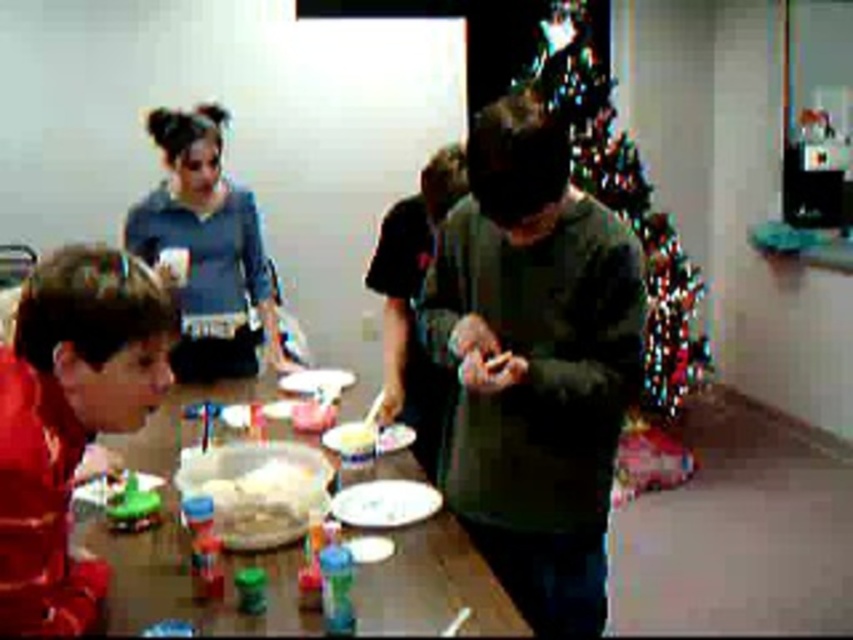
You are organizing a craft event and need to ensure there is enough space for all participants. Given the dark green sweater at center and the wooden table at lower left, which object takes up more space in the scene?

The wooden table at lower left takes up more space in the scene compared to the dark green sweater at center, as the dark green sweater at center has a smaller size compared to the wooden table at lower left.

You are standing in the room and want to pick up the wooden table at lower left. Can you reach it without moving the dark green sweater at center?

The dark green sweater at center is closer to you than the wooden table at lower left, so you would need to move the sweater first to access the table.